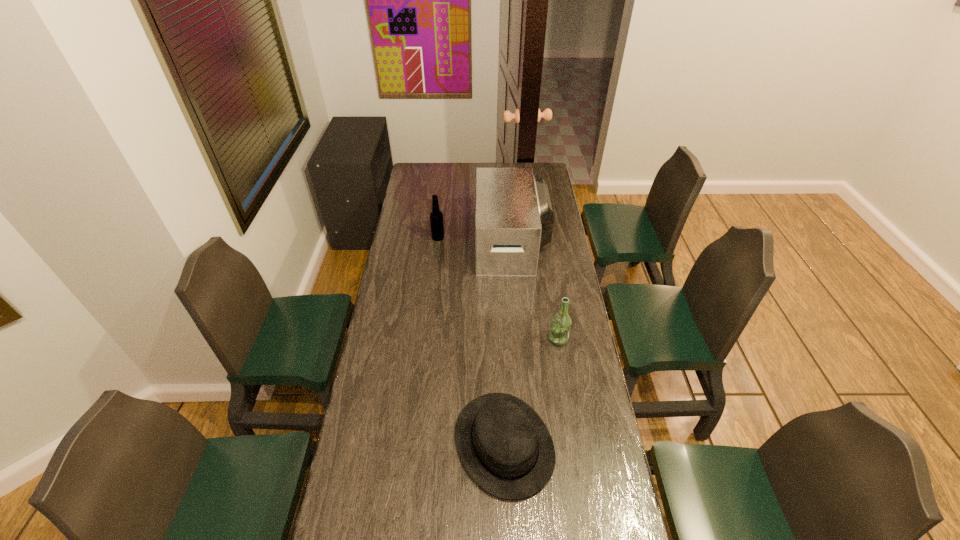
This screenshot has width=960, height=540. I want to click on vacant space at the far left corner of the desktop, so click(417, 181).

Find the location of a particular element. This screenshot has width=960, height=540. vacant region between the fedora and the microwave oven is located at coordinates (508, 343).

The height and width of the screenshot is (540, 960). I want to click on free space between the nearer beer bottle and the fedora, so click(531, 392).

The image size is (960, 540). Find the location of `vacant area that lies between the microwave oven and the fedora`. vacant area that lies between the microwave oven and the fedora is located at coordinates (508, 343).

This screenshot has width=960, height=540. Find the location of `free spot between the nearest object and the nearer beer bottle`. free spot between the nearest object and the nearer beer bottle is located at coordinates (531, 392).

In order to click on vacant point located between the farther beer bottle and the microwave oven in this screenshot , I will do `click(475, 240)`.

Locate an element on the screen. The image size is (960, 540). vacant point located between the microwave oven and the third farthest object is located at coordinates (535, 291).

Identify the location of empty location between the farther beer bottle and the second nearest object. The height and width of the screenshot is (540, 960). (498, 288).

Locate which object is the third closest to the shortest object. Please provide its 2D coordinates. Your answer should be formatted as a tuple, i.e. [(x, y)], where the tuple contains the x and y coordinates of a point satisfying the conditions above.

[(436, 216)]

What are the coordinates of `object that is the closest to the nearest object` in the screenshot? It's located at (560, 327).